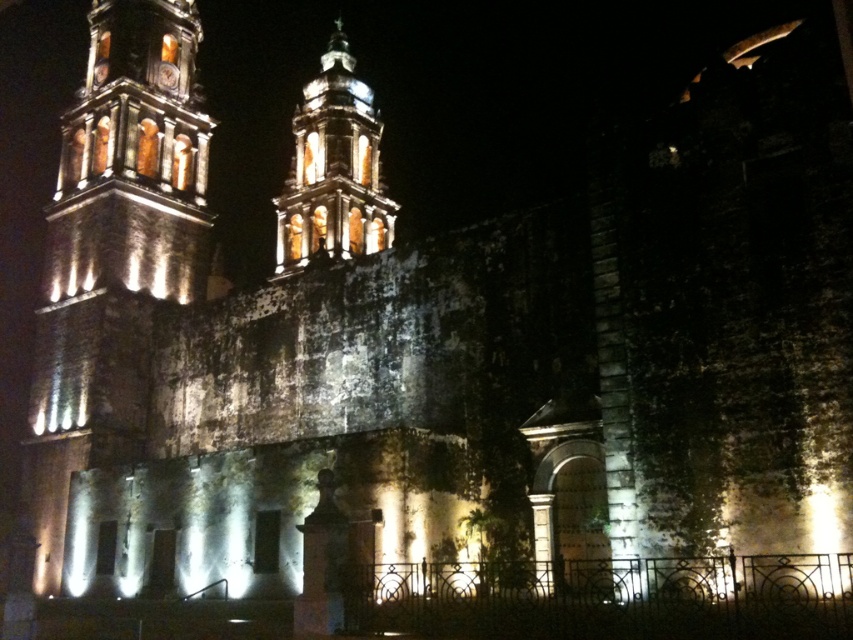
You are an architect examining the historic building at night. You notice two towers, the matte stone tower at left and the matte stone tower at center. Which tower has a smaller width?

The matte stone tower at left has a lesser width compared to the matte stone tower at center, so the matte stone tower at left is smaller in width.

You are standing at the center of the image and want to locate the matte stone tower at left. Can you tell me its coordinates relative to the image?

The matte stone tower at left is located at coordinates point (113, 253).

You are standing at the camera position and want to take a photo of the matte stone tower at left. If your camera has a maximum focus range of 40 meters, will it be able to capture the tower clearly?

The matte stone tower at left is 39.69 meters away from the camera, which is within the 40 meters maximum focus range. Therefore, the camera can capture the tower clearly.